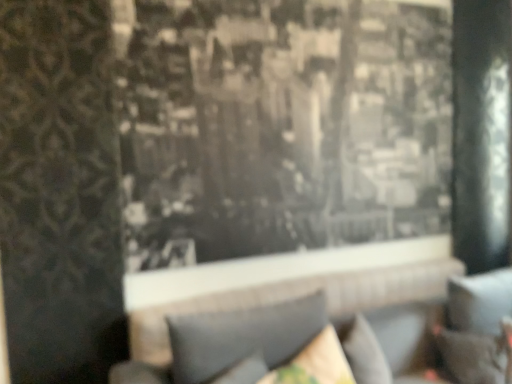
Question: Is textured gray pillow at lower center, which is the 1th pillow from left to right, inside velvet dark brown pillow at lower right, which ranks as the first pillow in right-to-left order?

Choices:
 (A) no
 (B) yes

Answer: (A)

Question: Is the depth of velvet dark brown pillow at lower right, the third pillow positioned from the left, greater than that of textured gray pillow at lower center, which is the 1th pillow from left to right?

Choices:
 (A) no
 (B) yes

Answer: (B)

Question: Can you confirm if velvet dark brown pillow at lower right, which ranks as the first pillow in right-to-left order, is taller than textured gray pillow at lower center, which is the 1th pillow from left to right?

Choices:
 (A) yes
 (B) no

Answer: (B)

Question: Can you confirm if velvet dark brown pillow at lower right, which ranks as the first pillow in right-to-left order, is smaller than textured gray pillow at lower center, placed as the 3th pillow when sorted from right to left?

Choices:
 (A) yes
 (B) no

Answer: (A)

Question: Is velvet dark brown pillow at lower right, which ranks as the first pillow in right-to-left order, facing towards textured gray pillow at lower center, which is the 1th pillow from left to right?

Choices:
 (A) yes
 (B) no

Answer: (B)

Question: Can you see velvet dark brown pillow at lower right, the third pillow positioned from the left, touching textured gray pillow at lower center, which is the 1th pillow from left to right?

Choices:
 (A) no
 (B) yes

Answer: (A)

Question: Considering the relative sizes of gray fabric couch at center and velvet dark brown pillow at lower right, which ranks as the first pillow in right-to-left order, in the image provided, is gray fabric couch at center wider than velvet dark brown pillow at lower right, which ranks as the first pillow in right-to-left order,?

Choices:
 (A) yes
 (B) no

Answer: (A)

Question: Can you confirm if gray fabric couch at center is positioned to the left of velvet dark brown pillow at lower right, the third pillow positioned from the left?

Choices:
 (A) no
 (B) yes

Answer: (B)

Question: Is gray fabric couch at center not near velvet dark brown pillow at lower right, the third pillow positioned from the left?

Choices:
 (A) yes
 (B) no

Answer: (B)

Question: Considering the relative sizes of gray fabric couch at center and velvet dark brown pillow at lower right, the third pillow positioned from the left, in the image provided, is gray fabric couch at center shorter than velvet dark brown pillow at lower right, the third pillow positioned from the left,?

Choices:
 (A) no
 (B) yes

Answer: (A)

Question: Is gray fabric couch at center turned away from velvet dark brown pillow at lower right, the third pillow positioned from the left?

Choices:
 (A) yes
 (B) no

Answer: (A)

Question: Considering the relative sizes of gray fabric couch at center and velvet dark brown pillow at lower right, which ranks as the first pillow in right-to-left order, in the image provided, is gray fabric couch at center thinner than velvet dark brown pillow at lower right, which ranks as the first pillow in right-to-left order,?

Choices:
 (A) no
 (B) yes

Answer: (A)

Question: Does velvet dark brown pillow at lower right, the third pillow positioned from the left, have a lesser height compared to velvet beige pillow at lower center, the second pillow in the right-to-left sequence?

Choices:
 (A) no
 (B) yes

Answer: (A)